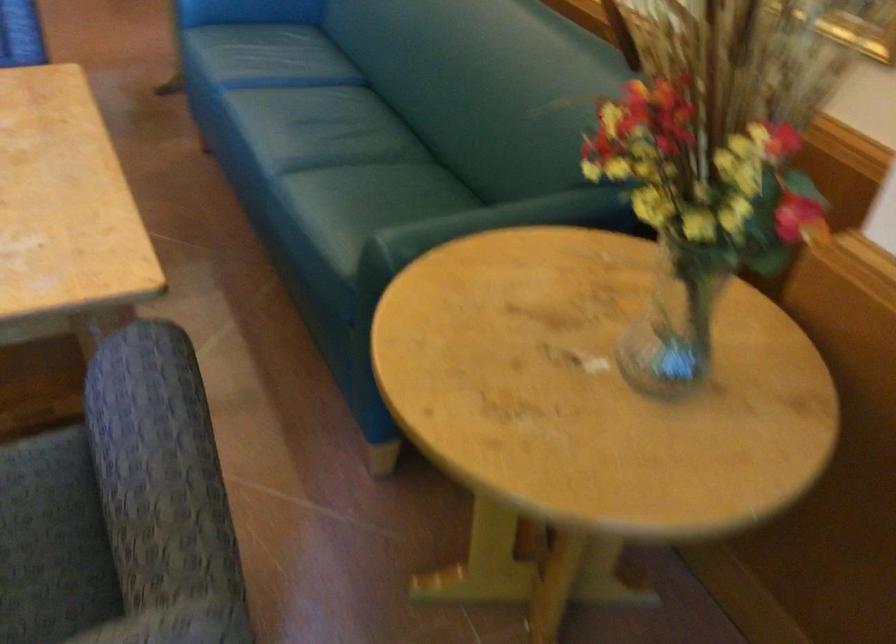
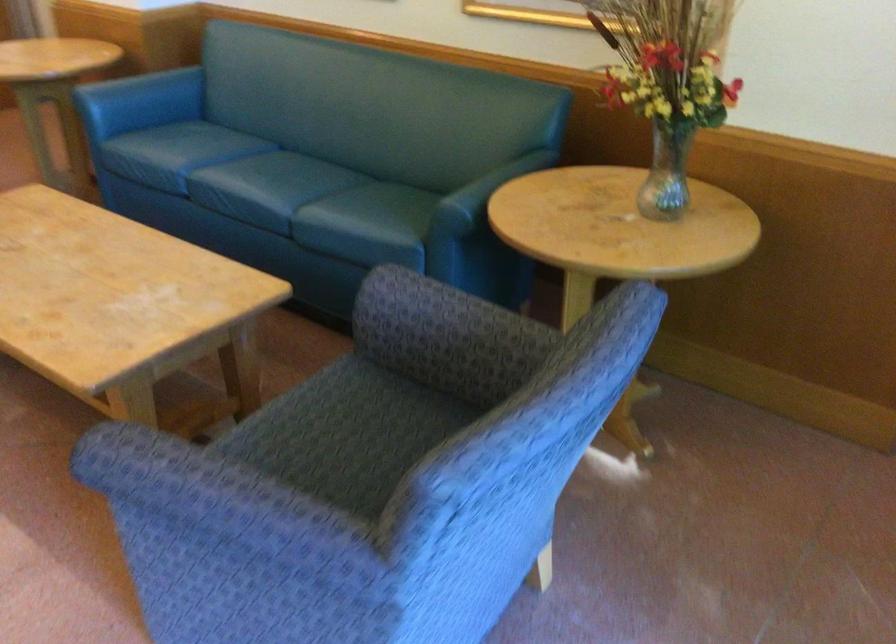
In the second image, find the point that corresponds to point 684,162 in the first image.

(667, 82)